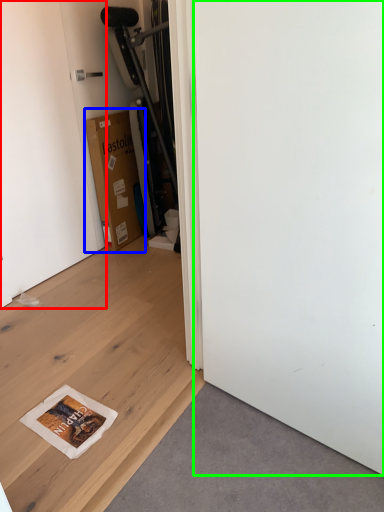
Question: Which is farther away from door (highlighted by a red box)? cardboard box (highlighted by a blue box) or screen door (highlighted by a green box)?

Choices:
 (A) cardboard box
 (B) screen door

Answer: (B)